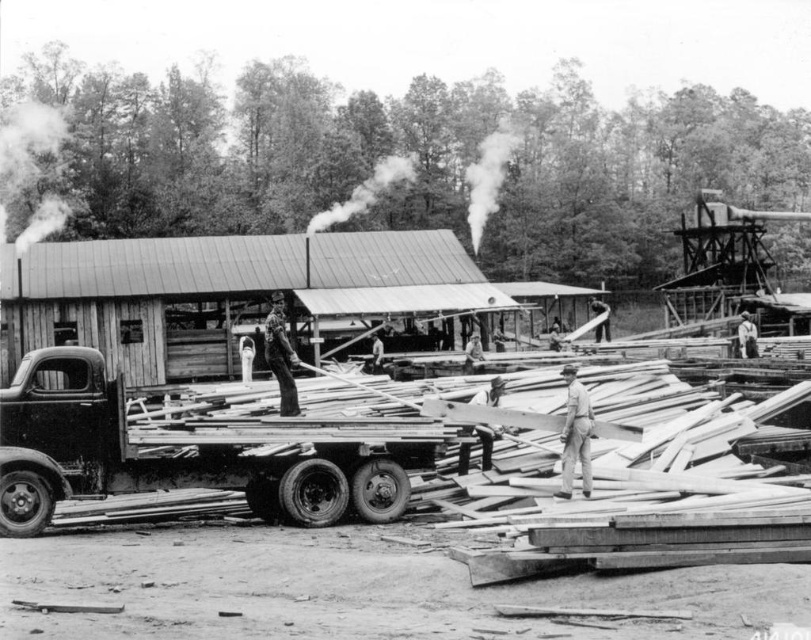
Question: Can you confirm if smooth wood boards at center is smaller than light brown wooden man at center?

Choices:
 (A) no
 (B) yes

Answer: (A)

Question: Which of the following is the farthest from the observer?

Choices:
 (A) wooden hut at center
 (B) rusty metal trailer truck at center

Answer: (A)

Question: Which object appears closest to the camera in this image?

Choices:
 (A) rusty metal trailer truck at center
 (B) wooden hut at center
 (C) light brown wooden man at center
 (D) wooden planks at center

Answer: (A)

Question: Does smooth wood boards at center have a greater width compared to light brown wooden man at center?

Choices:
 (A) no
 (B) yes

Answer: (B)

Question: Can you confirm if rusty metal trailer truck at center is smaller than light brown wooden man at center?

Choices:
 (A) yes
 (B) no

Answer: (B)

Question: Among these objects, which one is farthest from the camera?

Choices:
 (A) smooth wood boards at center
 (B) light brown wooden man at center
 (C) rusty metal trailer truck at center

Answer: (B)